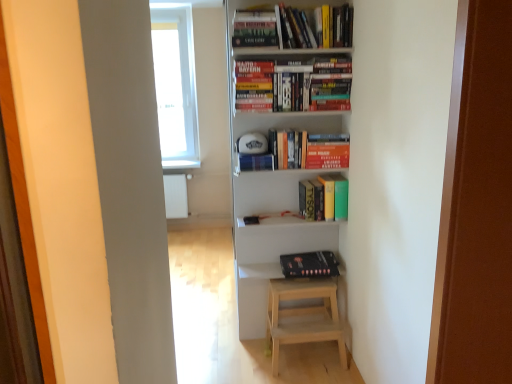
This screenshot has width=512, height=384. I want to click on blank space situated above black matte book at lower center, arranged as the 1th book when ordered from the bottom (from a real-world perspective), so click(305, 257).